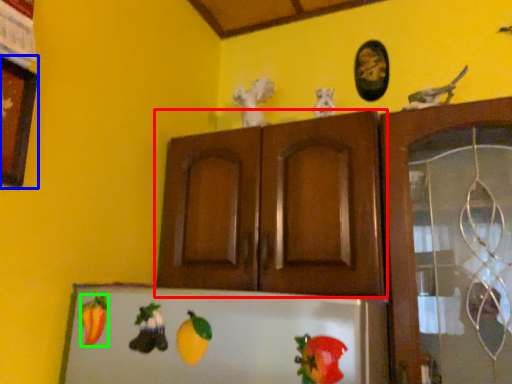
Question: Considering the real-world distances, which object is closest to cabinetry (highlighted by a red box)? picture frame (highlighted by a blue box) or fruit (highlighted by a green box).

Choices:
 (A) picture frame
 (B) fruit

Answer: (B)